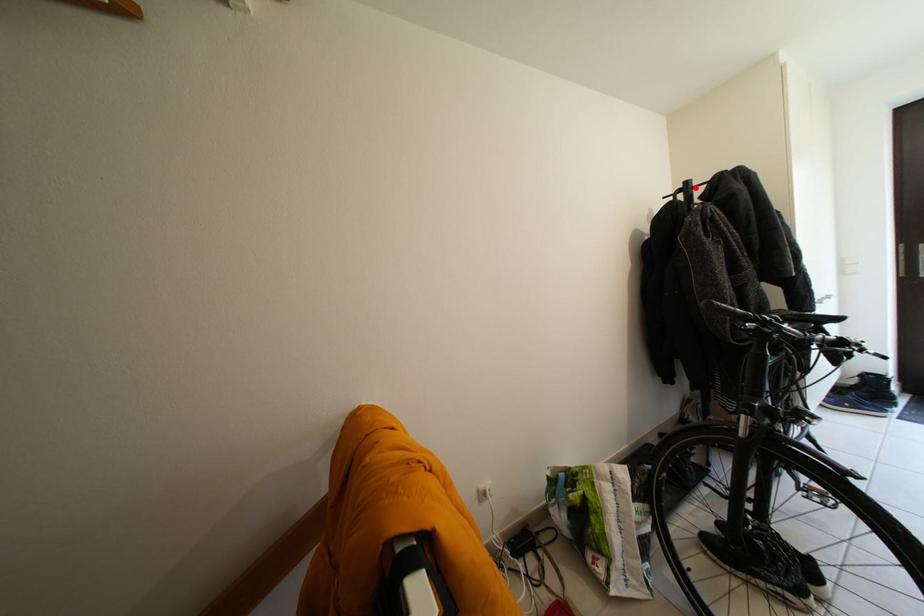
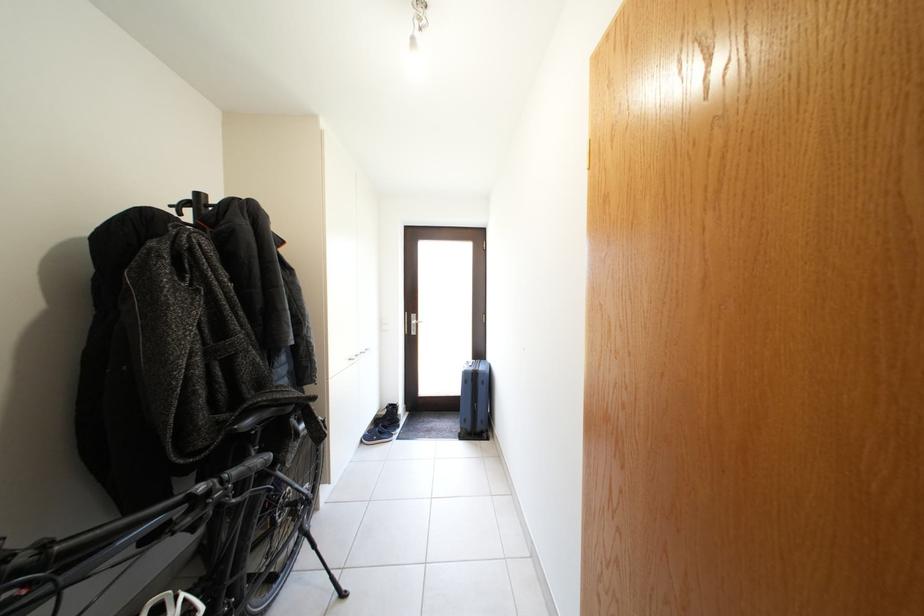
Find the pixel in the second image that matches the highlighted location in the first image.

(205, 200)